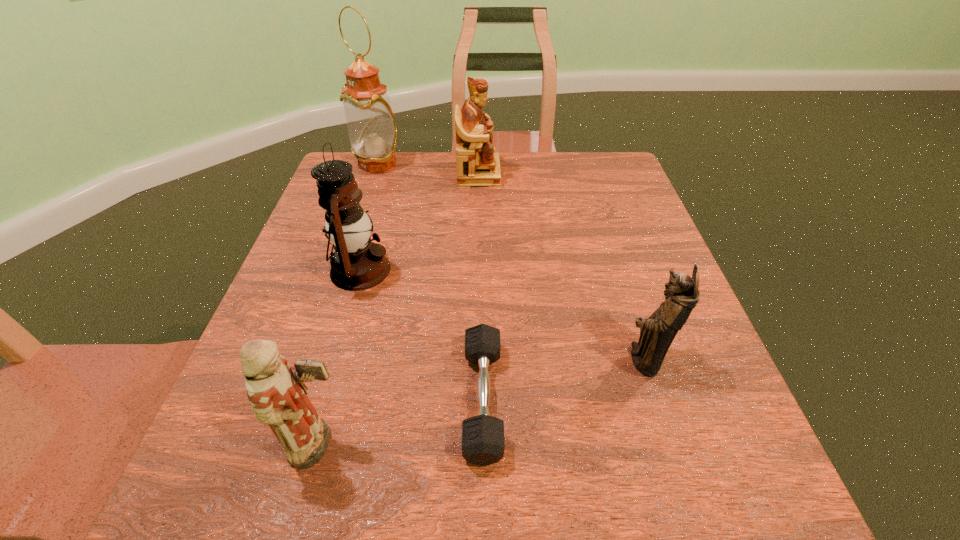
Where is `lantern present at the left edge`? lantern present at the left edge is located at coordinates (x=357, y=264).

Where is `figurine that is positioned at the left edge`? figurine that is positioned at the left edge is located at coordinates (276, 391).

Identify the location of object that is at the right edge. (657, 332).

I want to click on object that is at the far left corner, so pos(372,130).

Locate an element on the screen. object positioned at the near left corner is located at coordinates (276, 391).

Identify the location of free space at the far edge of the desktop. Image resolution: width=960 pixels, height=540 pixels. (518, 154).

The image size is (960, 540). What are the coordinates of `vacant space at the near edge of the desktop` in the screenshot? It's located at (501, 510).

Locate an element on the screen. blank space at the left edge of the desktop is located at coordinates (256, 426).

Find the location of a particular element. This screenshot has width=960, height=540. vacant space at the right edge is located at coordinates (647, 286).

Image resolution: width=960 pixels, height=540 pixels. Identify the location of vacant space at the far right corner. (592, 195).